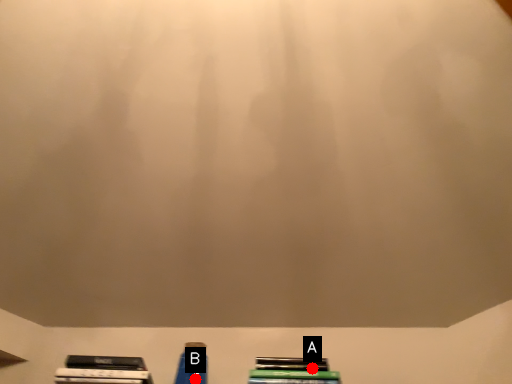
Question: Two points are circled on the image, labeled by A and B beside each circle. Which point appears farthest from the camera in this image?

Choices:
 (A) A is further
 (B) B is further

Answer: (A)